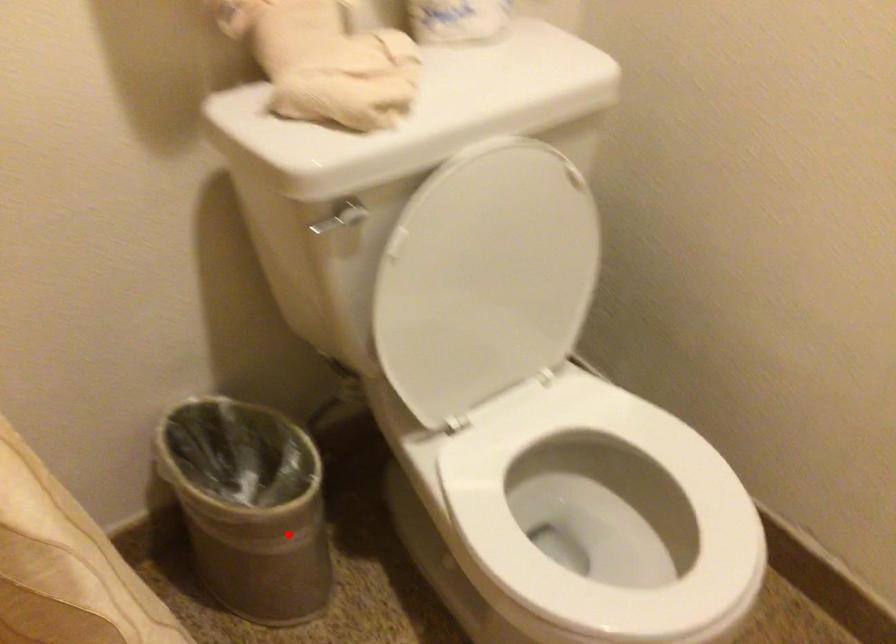
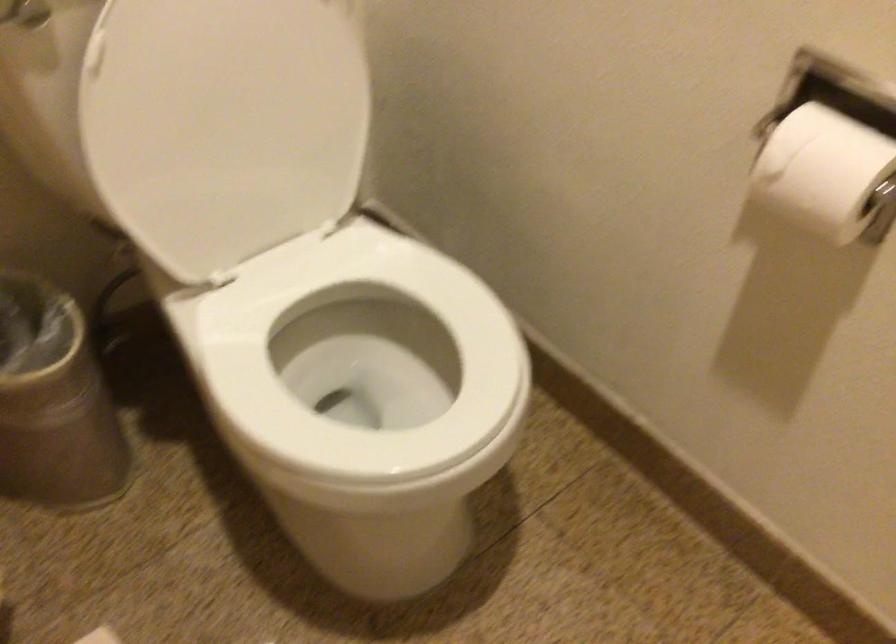
Locate, in the second image, the point that corresponds to the highlighted location in the first image.

(54, 402)